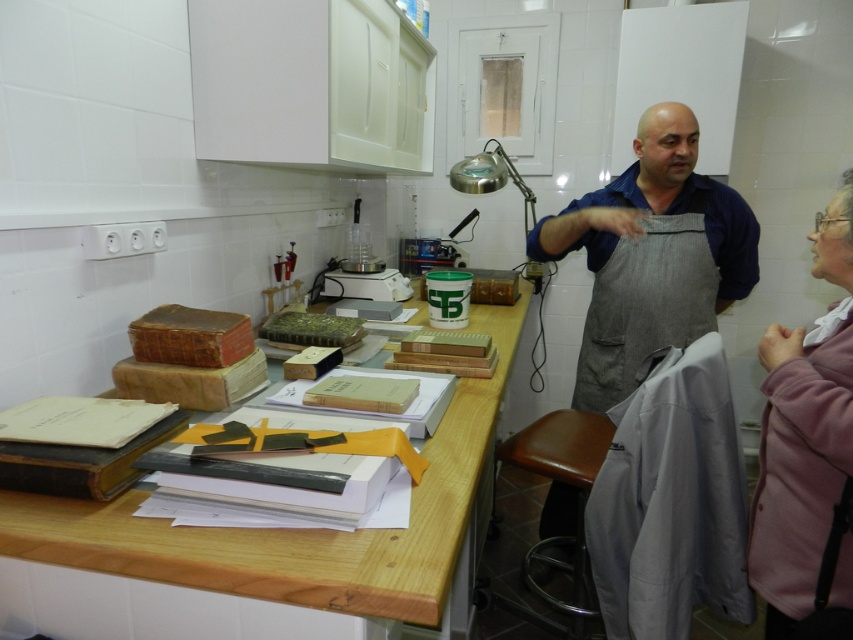
Who is more distant from viewer, (x=175, y=589) or (x=607, y=294)?

The point (x=607, y=294) is more distant.

Is point (338, 589) positioned after point (660, 248)?

No.

Find the location of a particular element. wooden table at center is located at coordinates (254, 545).

Where is `wooden table at center`? The height and width of the screenshot is (640, 853). wooden table at center is located at coordinates (254, 545).

Is pink fabric jacket at lower right smaller than gray cotton apron at center?

No, pink fabric jacket at lower right is not smaller than gray cotton apron at center.

Is pink fabric jacket at lower right further to camera compared to gray cotton apron at center?

No, it is not.

Image resolution: width=853 pixels, height=640 pixels. What do you see at coordinates (808, 454) in the screenshot? I see `pink fabric jacket at lower right` at bounding box center [808, 454].

Identify the location of pink fabric jacket at lower right. (808, 454).

In the scene shown: Does pink fabric jacket at lower right have a lesser width compared to brown leather stool at lower center?

Correct, pink fabric jacket at lower right's width is less than brown leather stool at lower center's.

Which is behind, point (820, 419) or point (498, 458)?

The point (498, 458) is behind.

Who is more forward, (x=781, y=506) or (x=578, y=568)?

Positioned in front is point (x=781, y=506).

The image size is (853, 640). Find the location of `pink fabric jacket at lower right`. pink fabric jacket at lower right is located at coordinates coord(808,454).